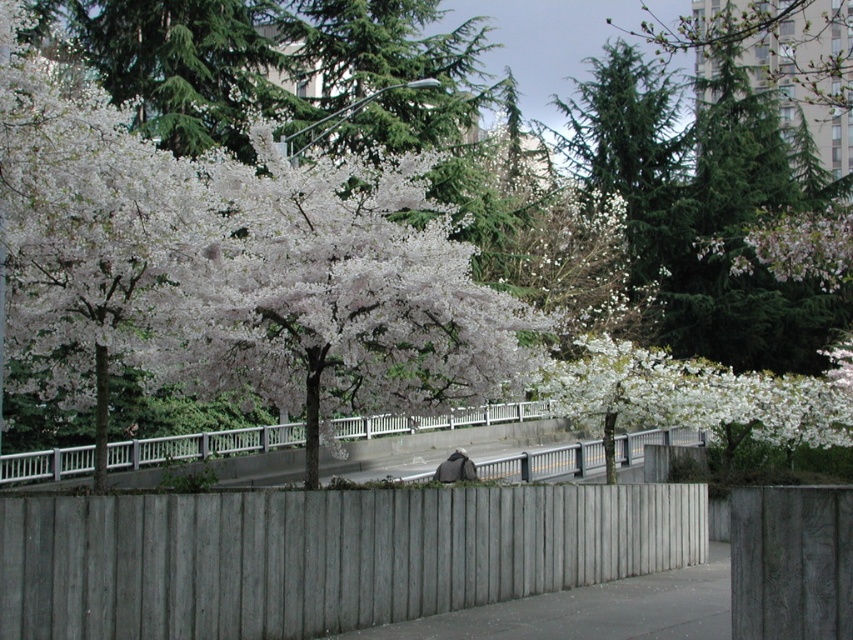
You are standing in the park and see the gray wood fence at center and the pink matte flower at upper right. Which object takes up more space in the image?

The pink matte flower at upper right takes up more space in the image because the gray wood fence at center has a smaller size compared to it.

You are standing in the park and see the gray wood fence at center and the dark gray fabric bag at center. Which object is taller?

The dark gray fabric bag at center is taller than the gray wood fence at center.